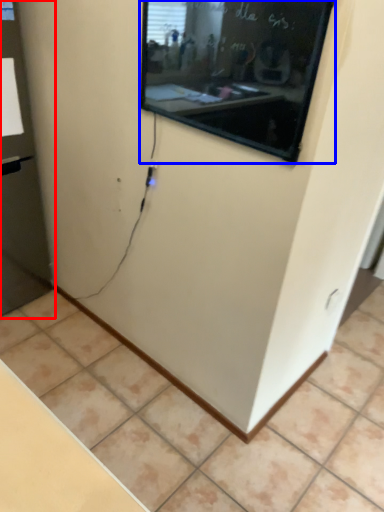
Question: Which object is closer to the camera taking this photo, glass door (highlighted by a red box) or projection screen (highlighted by a blue box)?

Choices:
 (A) glass door
 (B) projection screen

Answer: (B)